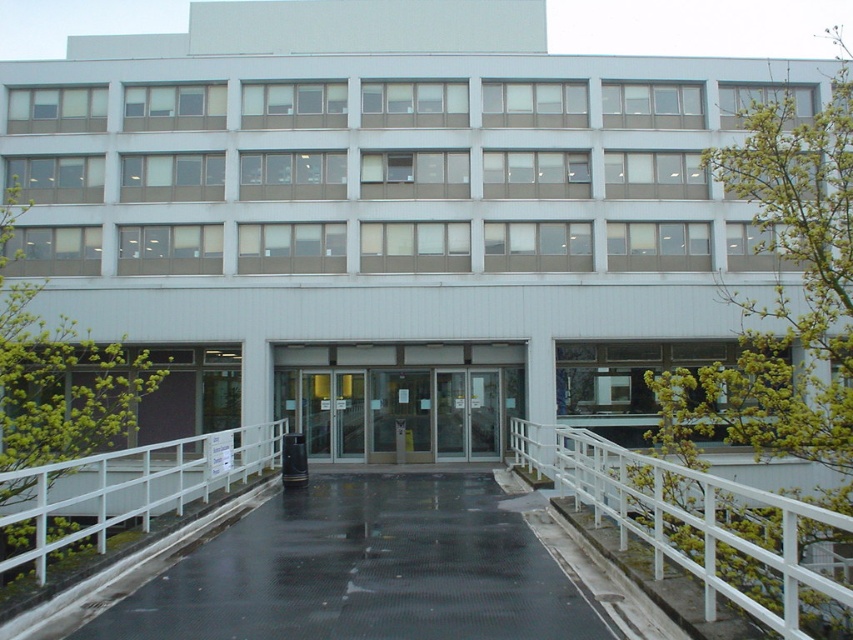
You are a delivery person approaching the entrance of the building. You need to place a large package on the pathway. Which object, the white metal railing at center or the white metal rail at lower left, should you avoid placing the package near to ensure it doesn,t get in the way of pedestrians?

You should avoid placing the package near the white metal railing at center because its width is larger than the white metal rail at lower left, making it a more prominent obstacle for pedestrians.

You are a delivery person with a cart that is 2 meters wide. You need to move from the white metal rail at lower left to the transparent glass doors at center. Can your cart fit through the space between them?

The distance between the transparent glass doors at center and the white metal rail at lower left is 4.24 meters. Since your cart is 2 meters wide, it can easily pass through the space between them as the distance is more than sufficient.